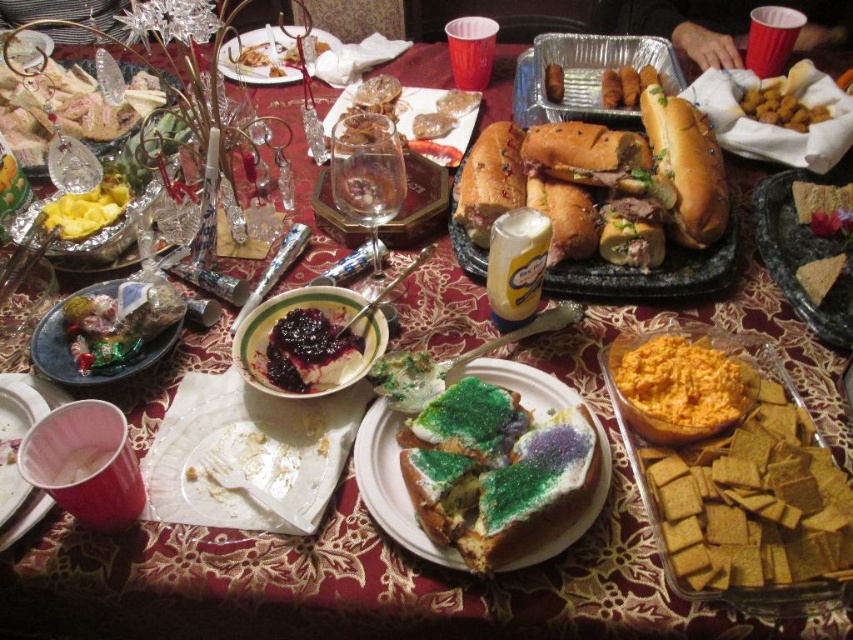
Can you confirm if yellow crumbly cheese at center is positioned to the left of clear glass plate at center?

No, yellow crumbly cheese at center is not to the left of clear glass plate at center.

What are the coordinates of `yellow crumbly cheese at center` in the screenshot? It's located at (822, 208).

Locate an element on the screen. Image resolution: width=853 pixels, height=640 pixels. yellow crumbly cheese at center is located at coordinates 822,208.

Does white paper plate at upper center lie behind yellow matte cheese at center?

That is True.

Between white paper plate at upper center and yellow matte cheese at center, which one has less height?

yellow matte cheese at center is shorter.

Measure the distance between point (230,65) and camera.

1.28 meters

The width and height of the screenshot is (853, 640). Identify the location of white paper plate at upper center. (260, 56).

Does orange creamy dip at center right have a greater width compared to golden brown bread at center?

Indeed, orange creamy dip at center right has a greater width compared to golden brown bread at center.

This screenshot has height=640, width=853. What do you see at coordinates (679, 387) in the screenshot?
I see `orange creamy dip at center right` at bounding box center [679, 387].

The width and height of the screenshot is (853, 640). In order to click on orange creamy dip at center right in this screenshot , I will do `click(679, 387)`.